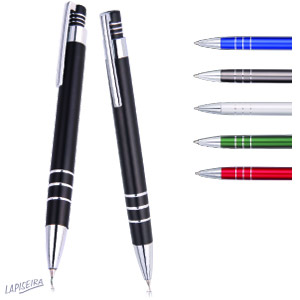
The image size is (300, 300). In order to click on pens in this screenshot , I will do `click(62, 153)`, `click(127, 162)`, `click(237, 45)`, `click(240, 75)`, `click(238, 107)`, `click(245, 143)`, `click(246, 170)`.